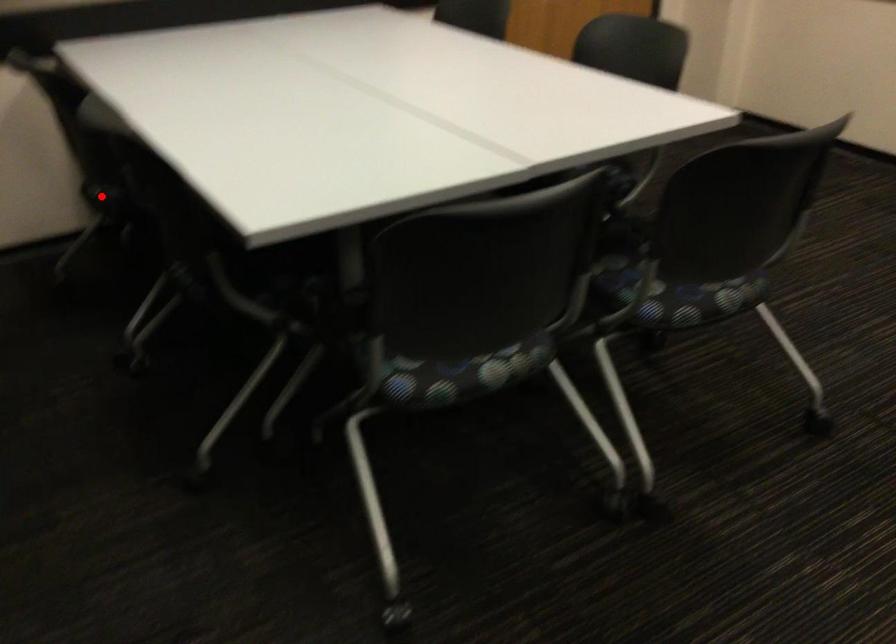
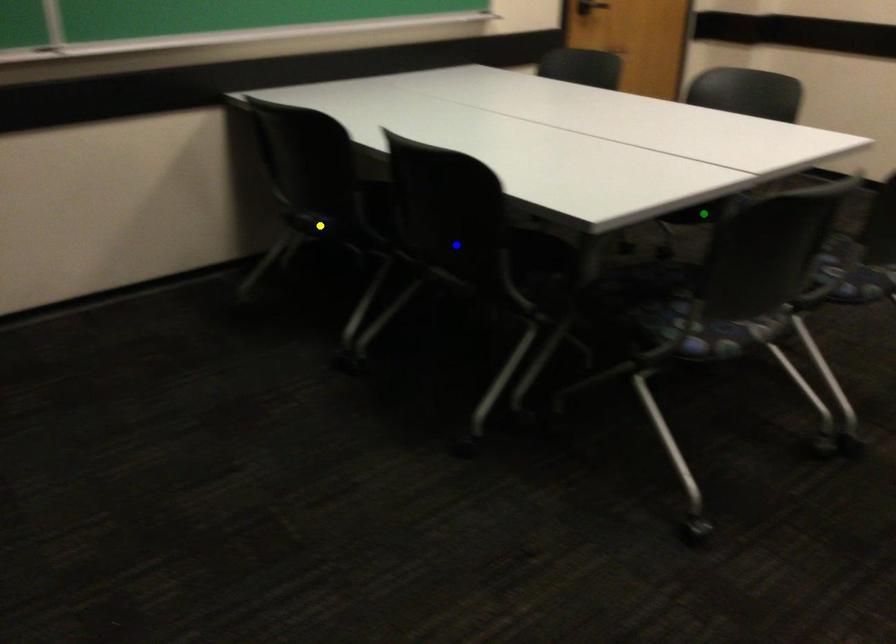
Question: I am providing you with two images of the same scene from different viewpoints. A red point is marked on the first image. You are given multiple points on the second image. Can you choose the point in image 2 that corresponds to the point in image 1?

Choices:
 (A) yellow point
 (B) green point
 (C) blue point

Answer: (A)